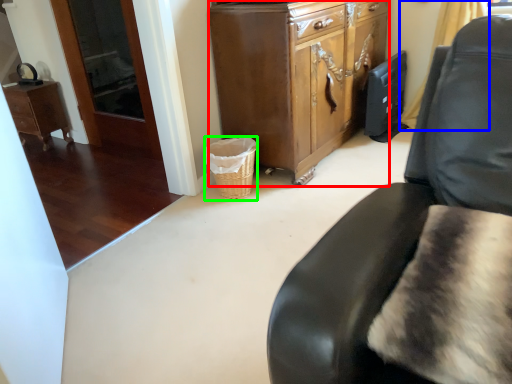
Question: Estimate the real-world distances between objects in this image. Which object is farther from cabinetry (highlighted by a red box), curtain (highlighted by a blue box) or basket (highlighted by a green box)?

Choices:
 (A) curtain
 (B) basket

Answer: (A)